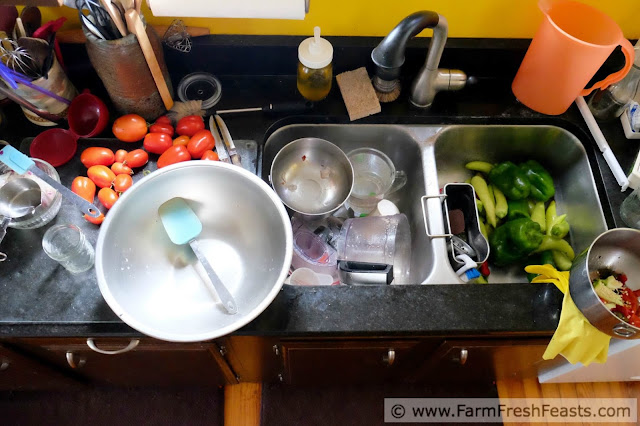
The width and height of the screenshot is (640, 426). Identify the location of pitcher. (569, 65).